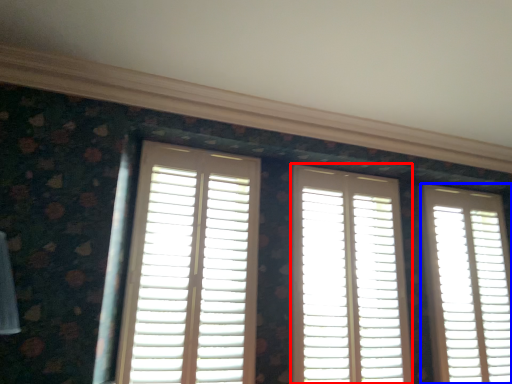
Question: Which object appears farthest to the camera in this image, window (highlighted by a red box) or window (highlighted by a blue box)?

Choices:
 (A) window
 (B) window

Answer: (B)